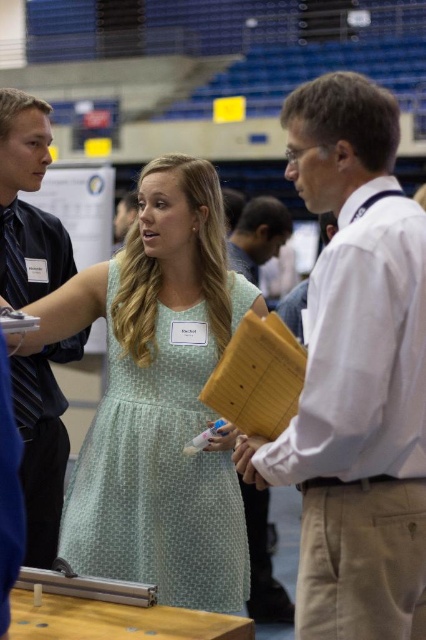
Question: Can you confirm if white shirt at center is positioned above light green polka dot dress at center?

Choices:
 (A) yes
 (B) no

Answer: (A)

Question: Which point is closer to the camera taking this photo?

Choices:
 (A) (176, 541)
 (B) (255, 204)

Answer: (A)

Question: Which point is closer to the camera?

Choices:
 (A) light green polka dot dress at center
 (B) white shirt at center
 (C) dark blue shirt at left

Answer: (B)

Question: Is light green polka dot dress at center smaller than light brown hair at center?

Choices:
 (A) no
 (B) yes

Answer: (A)

Question: Does light green polka dot dress at center appear over light brown hair at center?

Choices:
 (A) yes
 (B) no

Answer: (B)

Question: Among these objects, which one is farthest from the camera?

Choices:
 (A) white shirt at center
 (B) light brown hair at center
 (C) light green polka dot dress at center
 (D) dark blue shirt at left

Answer: (B)